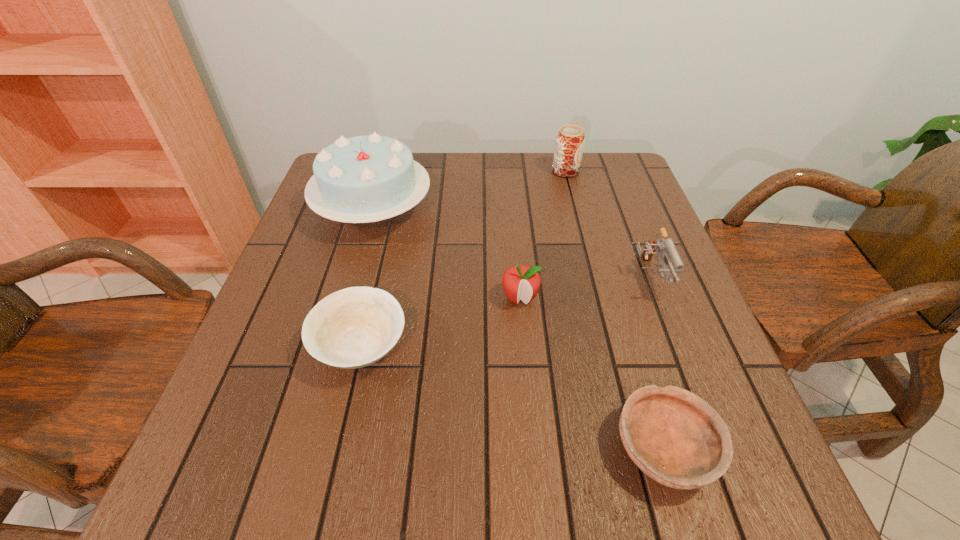
The height and width of the screenshot is (540, 960). I want to click on gun located in the right edge section of the desktop, so (666, 247).

Find the location of a particular element. The image size is (960, 540). bowl present at the right edge is located at coordinates (676, 438).

I want to click on object that is at the far left corner, so click(361, 179).

Identify the location of object located at the far right corner. (570, 140).

I want to click on object that is at the near right corner, so pyautogui.click(x=676, y=438).

Find the location of a particular element. Image resolution: width=960 pixels, height=540 pixels. vacant space at the far edge of the desktop is located at coordinates (537, 159).

Locate an element on the screen. free region at the near edge is located at coordinates (362, 512).

Find the location of a particular element. vacant space at the left edge of the desktop is located at coordinates (311, 245).

Find the location of `free region at the right edge`. free region at the right edge is located at coordinates (642, 313).

You are a GUI agent. You are given a task and a screenshot of the screen. Output one action in this format:
    pyautogui.click(x=<x>, y=<y>)
    Task: Click on the free location at the far right corner of the desktop
    The height and width of the screenshot is (540, 960).
    Given the screenshot: What is the action you would take?
    pyautogui.click(x=612, y=184)